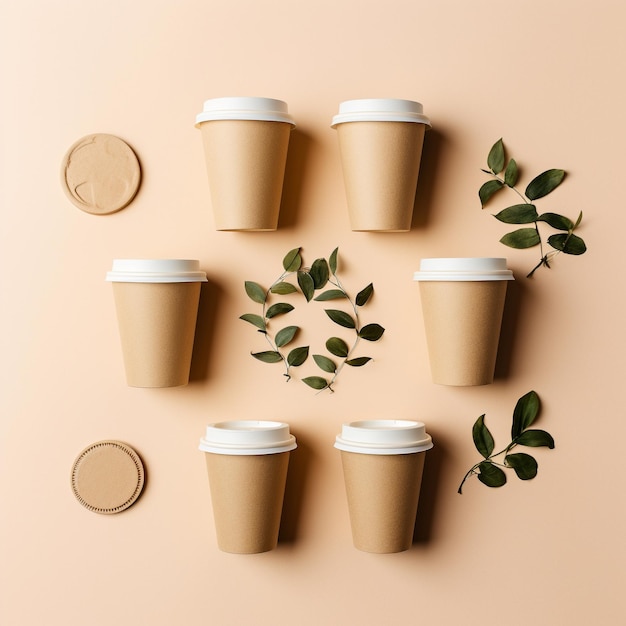
Locate an element on the screen. This screenshot has width=626, height=626. tan coffee cups is located at coordinates (182, 330), (260, 491), (402, 485), (473, 329), (397, 162), (263, 148).